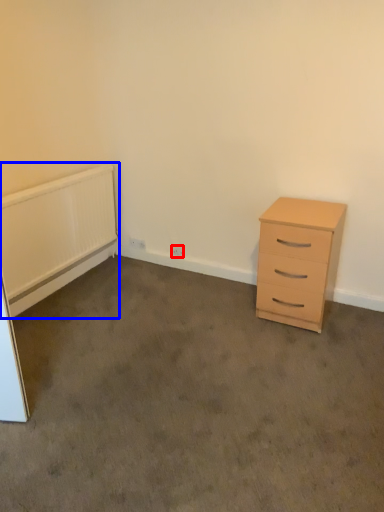
Question: Which point is closer to the camera, electric outlet (highlighted by a red box) or radiator (highlighted by a blue box)?

Choices:
 (A) electric outlet
 (B) radiator

Answer: (B)